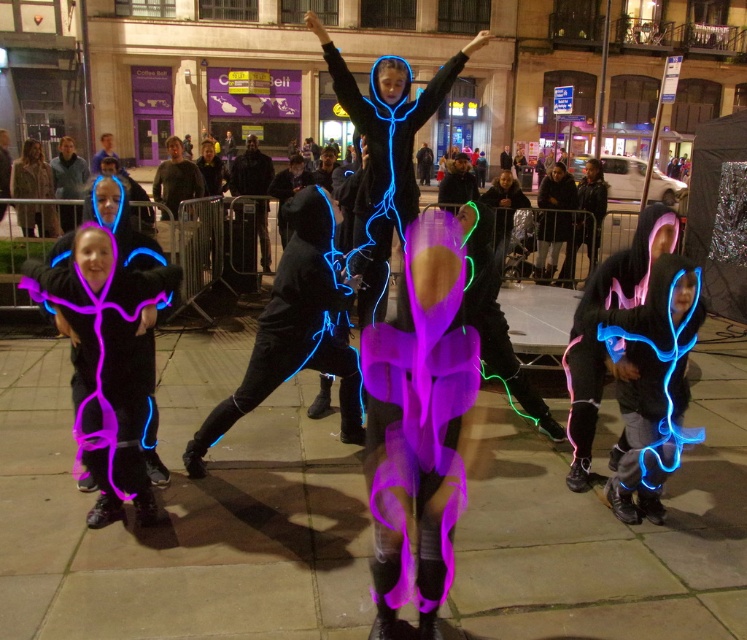
Who is lower down, neon blue fabric at center or neon purple fabric at center?

neon purple fabric at center is below.

Which is above, neon blue fabric at center or neon purple fabric at center?

neon blue fabric at center is above.

Who is more distant from viewer, (249, 358) or (610, 300)?

Positioned behind is point (249, 358).

I want to click on neon blue fabric at center, so click(x=294, y=330).